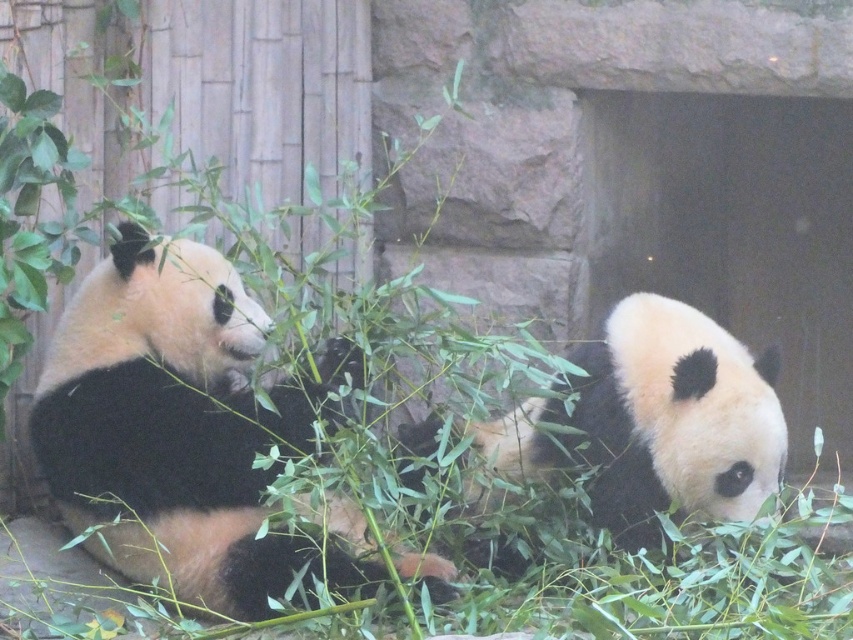
Question: Can you confirm if black fur panda at center is positioned to the right of black fur panda at right?

Choices:
 (A) yes
 (B) no

Answer: (B)

Question: Among these objects, which one is farthest from the camera?

Choices:
 (A) black fur panda at right
 (B) black fur panda at center

Answer: (A)

Question: Among these points, which one is farthest from the camera?

Choices:
 (A) (618, 412)
 (B) (219, 326)

Answer: (B)

Question: Does black fur panda at center have a greater width compared to black fur panda at right?

Choices:
 (A) yes
 (B) no

Answer: (A)

Question: Considering the relative positions of black fur panda at center and black fur panda at right in the image provided, where is black fur panda at center located with respect to black fur panda at right?

Choices:
 (A) below
 (B) above

Answer: (A)

Question: Which point is farther to the camera?

Choices:
 (A) pyautogui.click(x=109, y=540)
 (B) pyautogui.click(x=654, y=364)

Answer: (B)